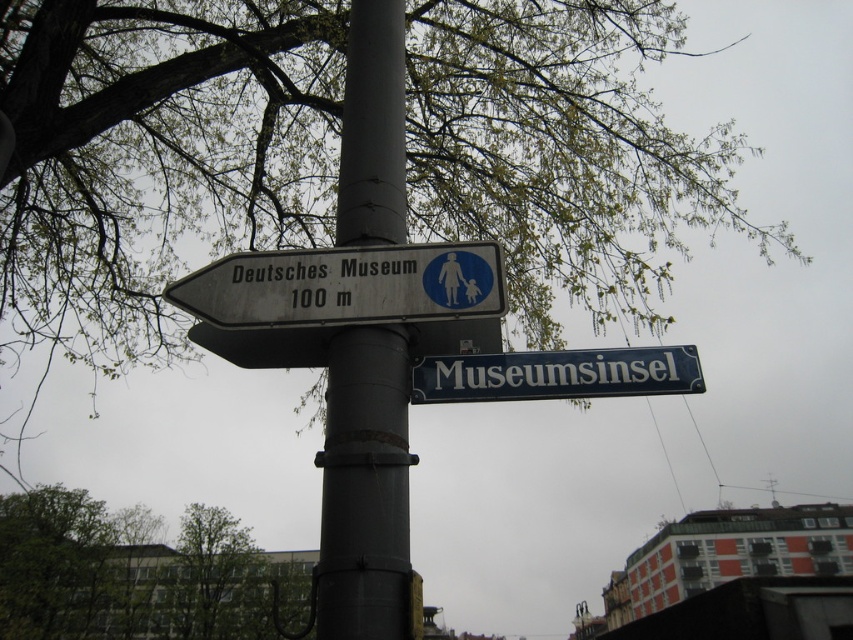
You are standing at the point marked by the coordinates point (345,285). Looking around, you see a white metallic sign at upper left. Which direction should you walk to reach the Deutsches Museum?

The Deutsches Museum is 100 meters to the left, as indicated by the arrow on the white metallic sign at upper left. You should walk in the direction the arrow points, which is to your left.

You are standing at the street signpost and want to take a photo that includes both the green leafy tree at upper left and the white metallic sign at upper left. Which object should you position closer to the edge of your camera frame to ensure both fit in the shot?

Since the green leafy tree at upper left is wider than the white metallic sign at upper left, you should position the wider green leafy tree at upper left closer to the edge of your camera frame to ensure both fit in the shot.